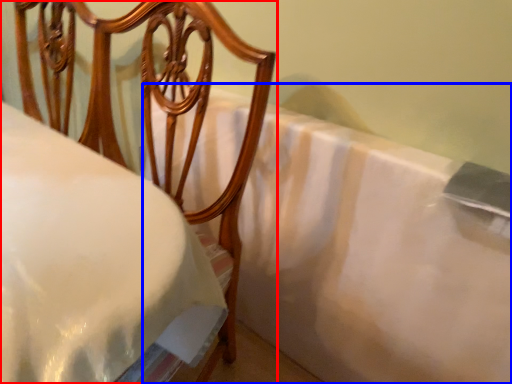
Question: Which object is further to the camera taking this photo, furniture (highlighted by a red box) or sheet (highlighted by a blue box)?

Choices:
 (A) furniture
 (B) sheet

Answer: (B)